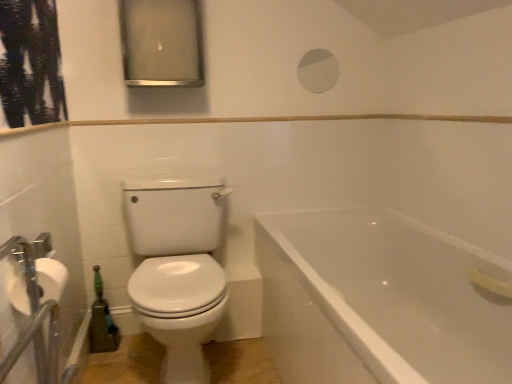
Measure the distance between point (381, 261) and camera.

Point (381, 261) and camera are 2.02 meters apart from each other.

Where is `white matte toilet paper at left`? white matte toilet paper at left is located at coordinates (51, 278).

This screenshot has width=512, height=384. What do you see at coordinates (51, 278) in the screenshot? I see `white matte toilet paper at left` at bounding box center [51, 278].

Image resolution: width=512 pixels, height=384 pixels. I want to click on matte silver medicine cabinet at upper center, so click(161, 43).

Describe the element at coordinates (318, 71) in the screenshot. I see `white glossy mirror at upper center` at that location.

Where is `white glossy bathtub at lower right`? The width and height of the screenshot is (512, 384). white glossy bathtub at lower right is located at coordinates (379, 300).

Is white matte toilet paper at left next to white glossy bathtub at lower right and touching it?

white matte toilet paper at left and white glossy bathtub at lower right are not in contact.

Is white matte toilet paper at left located outside white glossy bathtub at lower right?

That's correct, white matte toilet paper at left is outside of white glossy bathtub at lower right.

From a real-world perspective, between white matte toilet paper at left and white glossy bathtub at lower right, who is vertically higher?

white matte toilet paper at left, from a real-world perspective.

Considering the relative positions of white matte toilet paper at left and white glossy bathtub at lower right in the image provided, is white matte toilet paper at left to the left of white glossy bathtub at lower right from the viewer's perspective?

Yes.

Is matte silver medicine cabinet at upper center next to white glossy mirror at upper center and touching it?

matte silver medicine cabinet at upper center and white glossy mirror at upper center are clearly separated.

Considering the positions of objects matte silver medicine cabinet at upper center and white glossy mirror at upper center in the image provided, who is more to the left, matte silver medicine cabinet at upper center or white glossy mirror at upper center?

matte silver medicine cabinet at upper center is more to the left.

Is white glossy mirror at upper center at the back of matte silver medicine cabinet at upper center?

matte silver medicine cabinet at upper center is not turned away from white glossy mirror at upper center.

In the scene shown: Considering the relative sizes of matte silver medicine cabinet at upper center and white glossy mirror at upper center in the image provided, is matte silver medicine cabinet at upper center wider than white glossy mirror at upper center?

Indeed, matte silver medicine cabinet at upper center has a greater width compared to white glossy mirror at upper center.

Considering the relative positions of white glossy mirror at upper center and white glossy toilet at left in the image provided, is white glossy mirror at upper center to the left of white glossy toilet at left from the viewer's perspective?

In fact, white glossy mirror at upper center is to the right of white glossy toilet at left.

Who is taller, white glossy mirror at upper center or white glossy toilet at left?

Standing taller between the two is white glossy toilet at left.

What are the coordinates of `toilet on the left of white glossy mirror at upper center` in the screenshot? It's located at (177, 263).

From a real-world perspective, is white glossy mirror at upper center on top of white glossy toilet at left?

Yes.

Considering the sizes of objects white glossy toilet at left and white matte toilet paper at left in the image provided, who is thinner, white glossy toilet at left or white matte toilet paper at left?

white matte toilet paper at left is thinner.

From the image's perspective, which one is positioned higher, white glossy toilet at left or white matte toilet paper at left?

white matte toilet paper at left, from the image's perspective.

Between white glossy toilet at left and white matte toilet paper at left, which one appears on the left side from the viewer's perspective?

white matte toilet paper at left is more to the left.

Would you say white matte toilet paper at left is inside or outside matte silver medicine cabinet at upper center?

The correct answer is: outside.

Visually, is white matte toilet paper at left positioned to the left or to the right of matte silver medicine cabinet at upper center?

Clearly, white matte toilet paper at left is on the left of matte silver medicine cabinet at upper center in the image.

Considering the positions of point (59, 263) and point (165, 36), is point (59, 263) closer or farther from the camera than point (165, 36)?

Point (59, 263) appears to be closer to the viewer than point (165, 36).

From a real-world perspective, between white matte toilet paper at left and matte silver medicine cabinet at upper center, who is vertically lower?

white matte toilet paper at left.

Is white glossy toilet at left not within white glossy mirror at upper center?

Yes, white glossy toilet at left is outside of white glossy mirror at upper center.

I want to click on toilet lying in front of the white glossy mirror at upper center, so click(x=177, y=263).

Which object is positioned more to the right, white glossy toilet at left or white glossy mirror at upper center?

Positioned to the right is white glossy mirror at upper center.

From a real-world perspective, does white glossy toilet at left stand above white glossy mirror at upper center?

No.

Is matte silver medicine cabinet at upper center in contact with white glossy bathtub at lower right?

No, matte silver medicine cabinet at upper center is not in contact with white glossy bathtub at lower right.

Is matte silver medicine cabinet at upper center spatially inside white glossy bathtub at lower right, or outside of it?

The correct answer is: outside.

Can you confirm if matte silver medicine cabinet at upper center is smaller than white glossy bathtub at lower right?

Yes, matte silver medicine cabinet at upper center is smaller than white glossy bathtub at lower right.

Which is closer, (168,76) or (335,298)?

Point (168,76) appears to be farther away from the viewer than point (335,298).

Locate an element on the screen. The height and width of the screenshot is (384, 512). toilet paper above the white glossy bathtub at lower right (from a real-world perspective) is located at coordinates (51, 278).

Identify the location of mirror behind the matte silver medicine cabinet at upper center. The width and height of the screenshot is (512, 384). (318, 71).

When comparing their distances from white glossy toilet at left, does white matte toilet paper at left or matte silver medicine cabinet at upper center seem further?

Among the two, matte silver medicine cabinet at upper center is located further to white glossy toilet at left.

When comparing their distances from matte silver medicine cabinet at upper center, does white matte toilet paper at left or white glossy mirror at upper center seem further?

Among the two, white matte toilet paper at left is located further to matte silver medicine cabinet at upper center.

Looking at the image, which one is located closer to white matte toilet paper at left, matte silver medicine cabinet at upper center or white glossy mirror at upper center?

Based on the image, matte silver medicine cabinet at upper center appears to be nearer to white matte toilet paper at left.

From the image, which object appears to be nearer to matte silver medicine cabinet at upper center, white glossy toilet at left or white matte toilet paper at left?

Among the two, white glossy toilet at left is located nearer to matte silver medicine cabinet at upper center.

Which object lies further to the anchor point white glossy bathtub at lower right, white glossy mirror at upper center or white matte toilet paper at left?

white matte toilet paper at left lies further to white glossy bathtub at lower right than the other object.

Considering their positions, is white glossy bathtub at lower right positioned further to white glossy mirror at upper center than matte silver medicine cabinet at upper center?

Based on the image, white glossy bathtub at lower right appears to be further to white glossy mirror at upper center.

Based on their spatial positions, is white glossy mirror at upper center or matte silver medicine cabinet at upper center closer to white matte toilet paper at left?

matte silver medicine cabinet at upper center is closer to white matte toilet paper at left.

Looking at the image, which one is located closer to white glossy mirror at upper center, white matte toilet paper at left or matte silver medicine cabinet at upper center?

Based on the image, matte silver medicine cabinet at upper center appears to be nearer to white glossy mirror at upper center.

Image resolution: width=512 pixels, height=384 pixels. I want to click on mirror between matte silver medicine cabinet at upper center and white glossy toilet at left vertically, so click(x=318, y=71).

Locate an element on the screen. toilet paper between matte silver medicine cabinet at upper center and white glossy toilet at left in the up-down direction is located at coordinates (51, 278).

The height and width of the screenshot is (384, 512). Find the location of `toilet paper between matte silver medicine cabinet at upper center and white glossy bathtub at lower right in the vertical direction`. toilet paper between matte silver medicine cabinet at upper center and white glossy bathtub at lower right in the vertical direction is located at coordinates (51, 278).

This screenshot has width=512, height=384. Identify the location of medicine cabinet between white glossy bathtub at lower right and white glossy mirror at upper center from front to back. (161, 43).